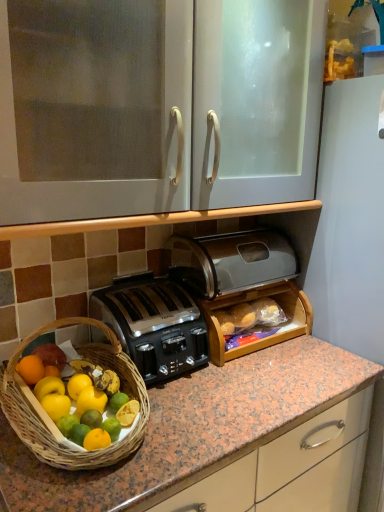
Question: In terms of size, does white glossy cabinet at upper center, the second cabinetry ordered from the bottom, appear bigger or smaller than satin black toaster at center, arranged as the first toaster when viewed from the top?

Choices:
 (A) small
 (B) big

Answer: (B)

Question: Is white glossy cabinet at upper center, which ranks as the 1th cabinetry in top-to-bottom order, inside the boundaries of satin black toaster at center, arranged as the second toaster when ordered from the bottom, or outside?

Choices:
 (A) inside
 (B) outside

Answer: (B)

Question: Which is farther from the wooden bread box at center, acting as the first cabinetry starting from the bottom?

Choices:
 (A) satin black toaster at center, arranged as the first toaster when viewed from the top
 (B) satin black toaster at center, placed as the second toaster when sorted from top to bottom
 (C) white glossy cabinet at upper center, the second cabinetry ordered from the bottom

Answer: (C)

Question: Considering the real-world distances, which object is farthest from the satin black toaster at center, the 1th toaster ordered from the bottom?

Choices:
 (A) white glossy cabinet at upper center, the second cabinetry ordered from the bottom
 (B) satin black toaster at center, arranged as the second toaster when ordered from the bottom
 (C) wooden bread box at center, which is the second cabinetry in top-to-bottom order

Answer: (A)